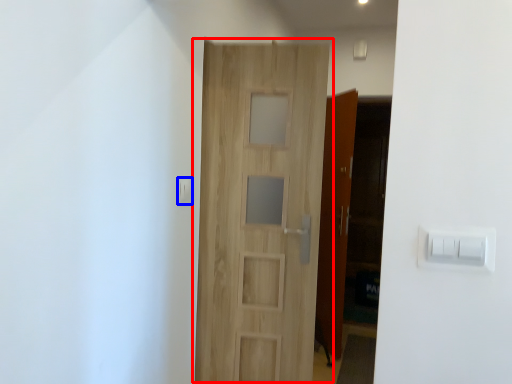
Question: Which of the following is the closest to the observer, door (highlighted by a red box) or light switch (highlighted by a blue box)?

Choices:
 (A) door
 (B) light switch

Answer: (B)